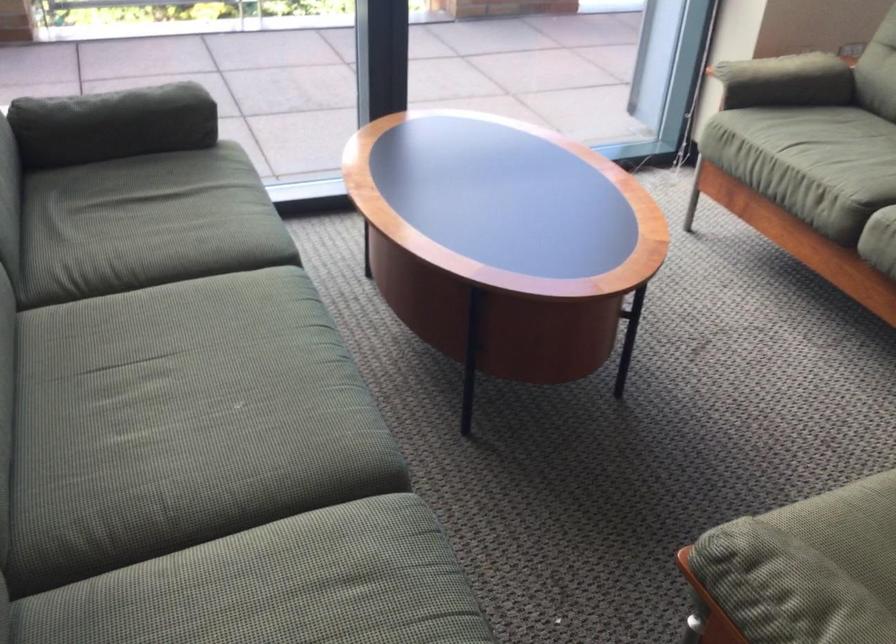
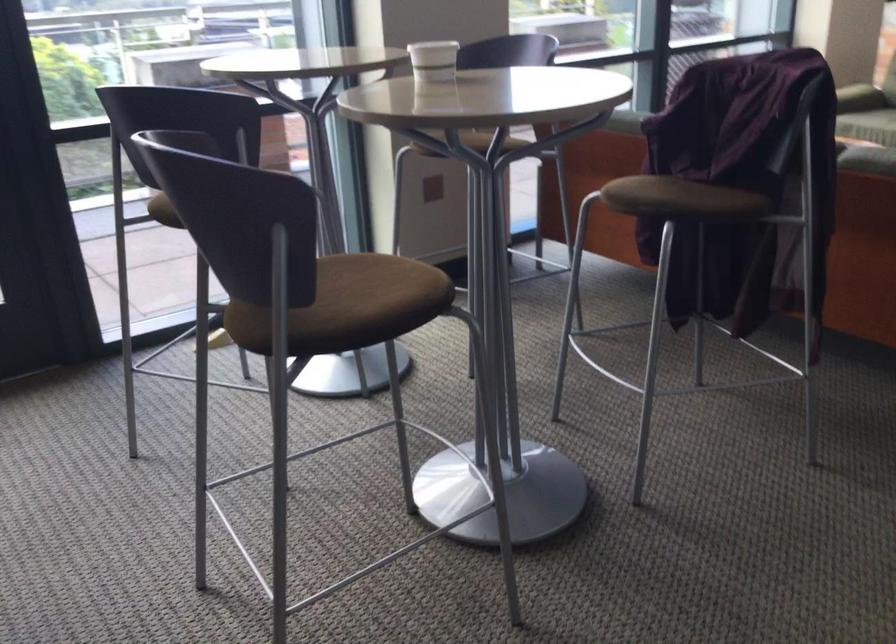
Question: I am providing you with two images of the same scene from different viewpoints. After the viewpoint changes to image2, which objects are now occluded?

Choices:
 (A) brown chair sitting surface
 (B) green sofa sitting surface
 (C) pink glove
 (D) white paper cup

Answer: (B)